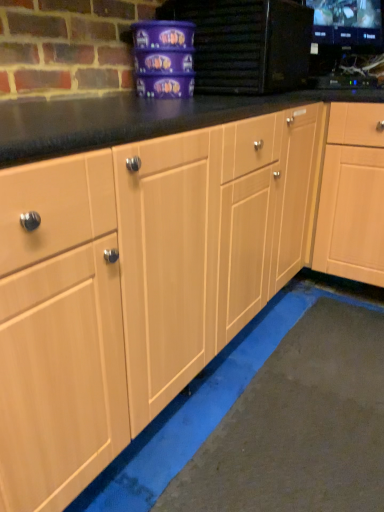
Question: Considering the relative sizes of black glossy tv at upper right, the second appliance when ordered from left to right, and black glossy monitor at upper right in the image provided, is black glossy tv at upper right, the second appliance when ordered from left to right, bigger than black glossy monitor at upper right?

Choices:
 (A) yes
 (B) no

Answer: (B)

Question: Considering the relative sizes of black glossy tv at upper right, the second appliance when ordered from left to right, and black glossy monitor at upper right in the image provided, is black glossy tv at upper right, the second appliance when ordered from left to right, taller than black glossy monitor at upper right?

Choices:
 (A) yes
 (B) no

Answer: (B)

Question: Is black glossy tv at upper right, which is the first appliance from right to left, oriented towards black glossy monitor at upper right?

Choices:
 (A) yes
 (B) no

Answer: (B)

Question: From a real-world perspective, does black glossy tv at upper right, which is the first appliance from right to left, sit lower than black glossy monitor at upper right?

Choices:
 (A) yes
 (B) no

Answer: (A)

Question: Considering the relative sizes of black glossy tv at upper right, the second appliance when ordered from left to right, and black glossy monitor at upper right in the image provided, is black glossy tv at upper right, the second appliance when ordered from left to right, shorter than black glossy monitor at upper right?

Choices:
 (A) no
 (B) yes

Answer: (B)

Question: Considering the relative positions of black glossy tv at upper right, the second appliance when ordered from left to right, and black glossy monitor at upper right in the image provided, is black glossy tv at upper right, the second appliance when ordered from left to right, behind black glossy monitor at upper right?

Choices:
 (A) no
 (B) yes

Answer: (B)

Question: Does light wood cabinet at center appear on the left side of matte purple container at upper center, the first appliance in the left-to-right sequence?

Choices:
 (A) no
 (B) yes

Answer: (A)

Question: From a real-world perspective, is light wood cabinet at center on matte purple container at upper center, the first appliance in the left-to-right sequence?

Choices:
 (A) yes
 (B) no

Answer: (B)

Question: Does light wood cabinet at center contain matte purple container at upper center, which is the second appliance in right-to-left order?

Choices:
 (A) yes
 (B) no

Answer: (B)

Question: Does light wood cabinet at center have a lesser width compared to matte purple container at upper center, the first appliance in the left-to-right sequence?

Choices:
 (A) yes
 (B) no

Answer: (B)

Question: Does light wood cabinet at center have a larger size compared to matte purple container at upper center, the first appliance in the left-to-right sequence?

Choices:
 (A) no
 (B) yes

Answer: (B)

Question: Can you confirm if light wood cabinet at center is taller than matte purple container at upper center, the first appliance in the left-to-right sequence?

Choices:
 (A) no
 (B) yes

Answer: (B)

Question: Is matte purple container at upper center, the first appliance in the left-to-right sequence, behind black glossy monitor at upper right?

Choices:
 (A) no
 (B) yes

Answer: (A)